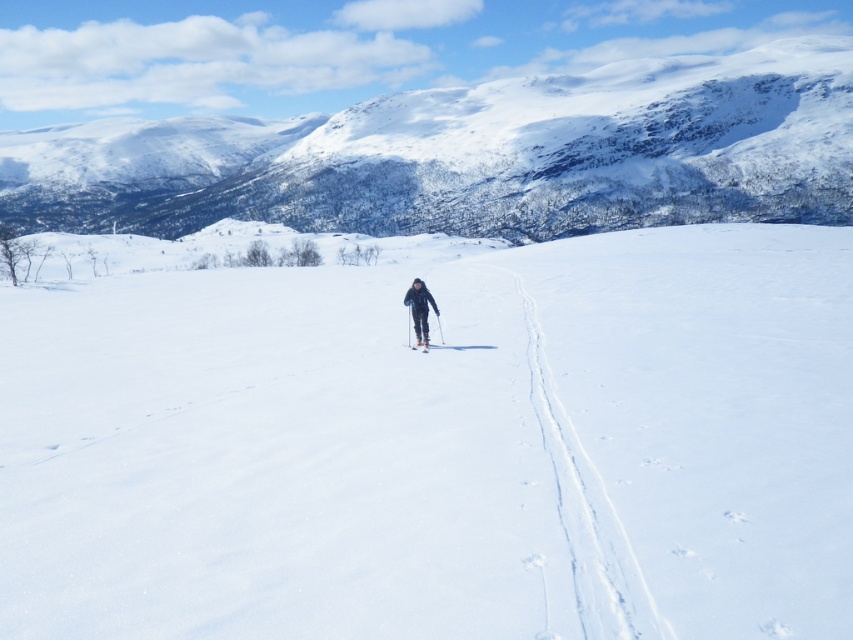
Question: Which object is closer to the camera taking this photo?

Choices:
 (A) black matte ski suit at center
 (B) white matte ski at center

Answer: (B)

Question: Which object is farther from the camera taking this photo?

Choices:
 (A) black matte ski suit at center
 (B) white matte ski at center
 (C) white snow ski slope at center

Answer: (A)

Question: In this image, where is snowy white mountain at upper center located relative to white matte ski at center?

Choices:
 (A) right
 (B) left

Answer: (B)

Question: Does black matte ski suit at center appear over white matte ski at center?

Choices:
 (A) no
 (B) yes

Answer: (B)

Question: Which object appears closest to the camera in this image?

Choices:
 (A) black matte ski suit at center
 (B) white matte ski at center

Answer: (B)

Question: From the image, what is the correct spatial relationship of white snow ski slope at center in relation to snowy white mountain at upper center?

Choices:
 (A) right
 (B) left

Answer: (A)